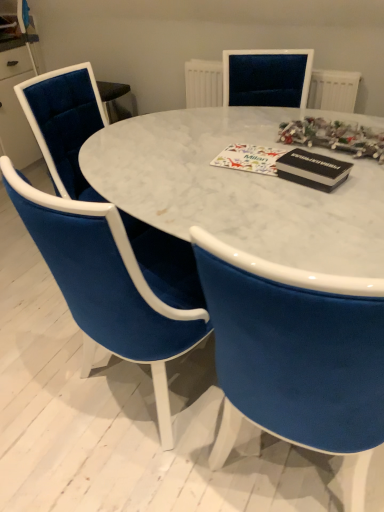
At what (x,y) coordinates should I click in order to perform the action: click on empty space that is ontop of white matte christmas card at center (from a real-world perspective). Please return your answer as a coordinate pair (x, y). Looking at the image, I should click on (249, 151).